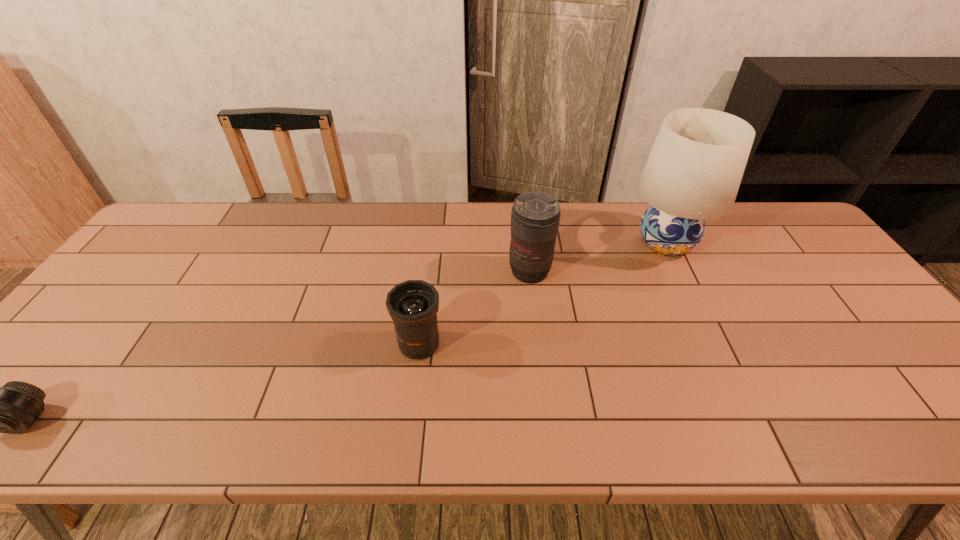
Where is `telephoto lens that is the closest to the farthest telephoto lens`? This screenshot has width=960, height=540. telephoto lens that is the closest to the farthest telephoto lens is located at coordinates (413, 305).